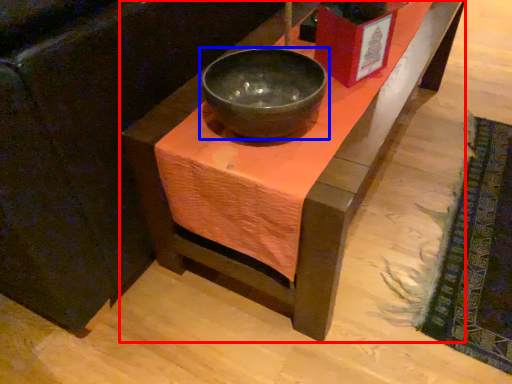
Question: Which of the following is the farthest to the observer, table (highlighted by a red box) or bowl (highlighted by a blue box)?

Choices:
 (A) table
 (B) bowl

Answer: (B)